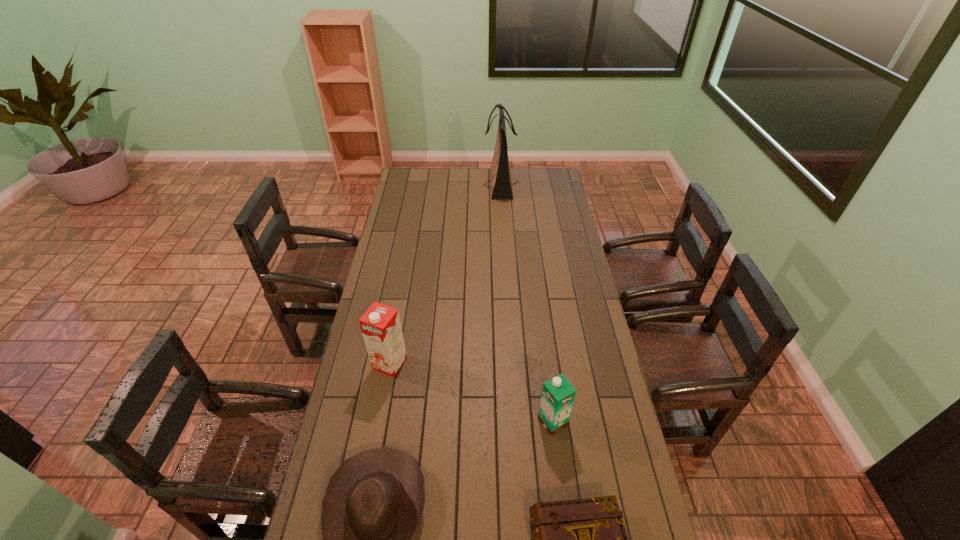
In order to click on vacant region between the shorter carton and the shopping bag in this screenshot , I will do `click(526, 303)`.

Image resolution: width=960 pixels, height=540 pixels. I want to click on object that is the closest to the cowboy hat, so click(x=381, y=327).

Choose which object is the third nearest neighbor to the second shortest object. Please provide its 2D coordinates. Your answer should be formatted as a tuple, i.e. [(x, y)], where the tuple contains the x and y coordinates of a point satisfying the conditions above.

[(558, 394)]

The height and width of the screenshot is (540, 960). What are the coordinates of `free space that satisfies the following two spatial constraints: 1. on the front-facing side of the shopping bag; 2. on the right side of the third shortest object` in the screenshot? It's located at (515, 422).